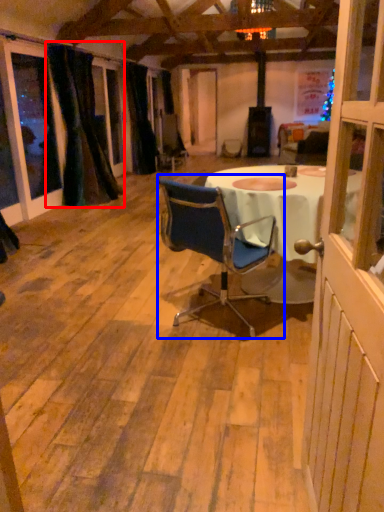
Question: Which object is further to the camera taking this photo, curtain (highlighted by a red box) or chair (highlighted by a blue box)?

Choices:
 (A) curtain
 (B) chair

Answer: (A)